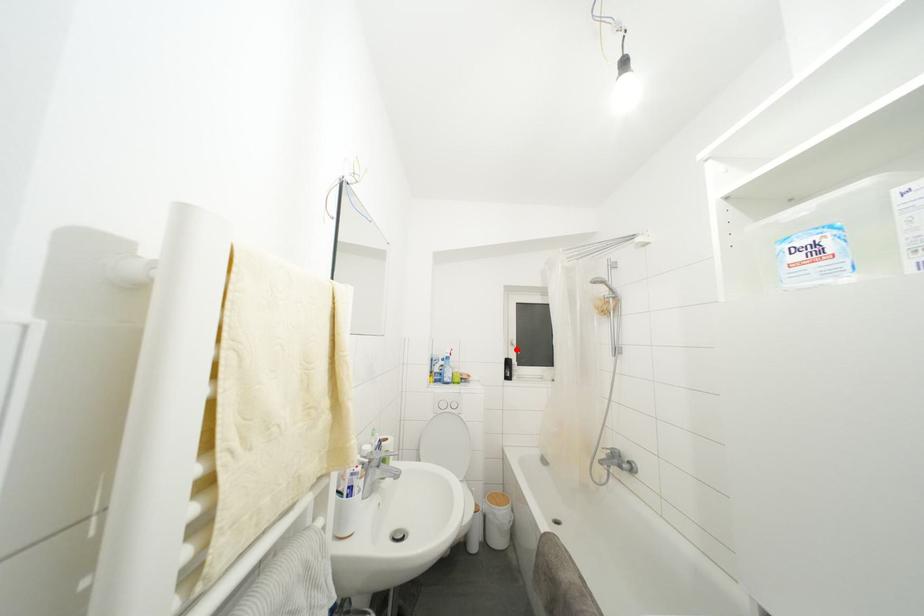
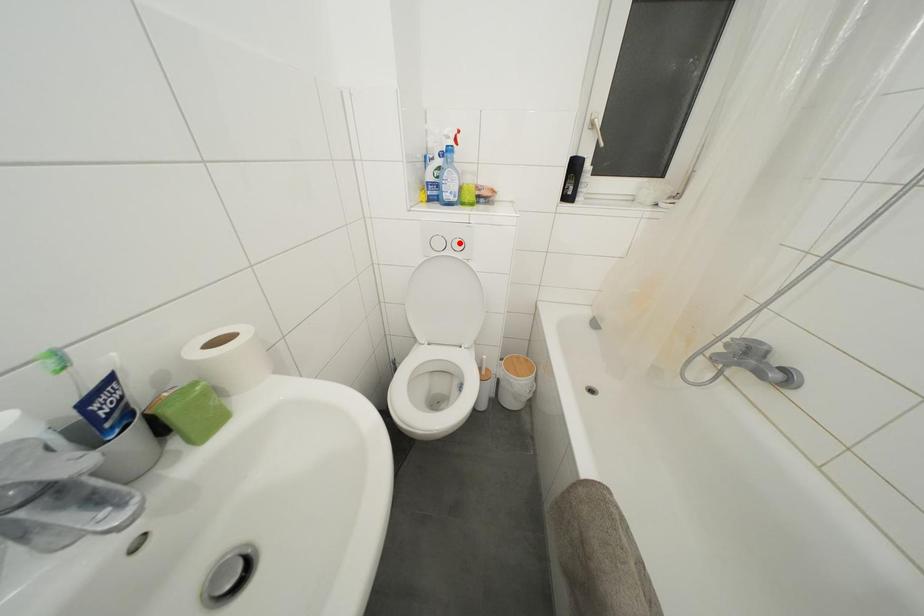
I am providing you with two images of the same scene from different viewpoints. A red point is marked on the first image and another point is marked on the second image. Does the point marked in image1 correspond to the same location as the one in image2?

No